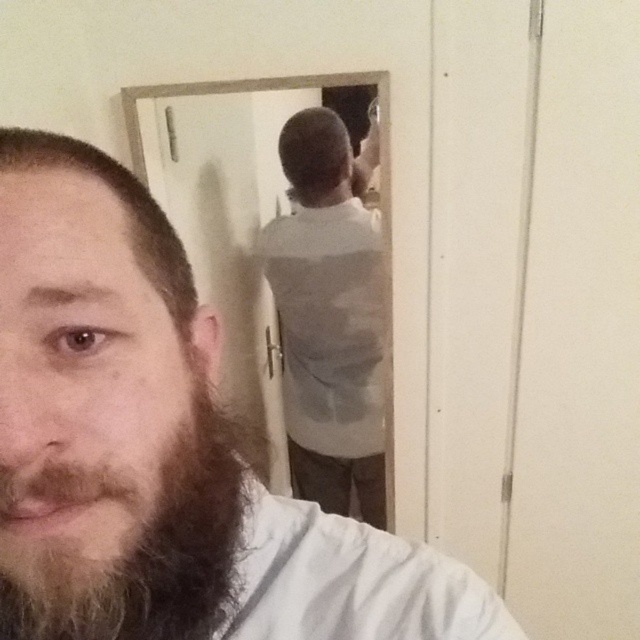
Question: Which point is farther to the camera?

Choices:
 (A) white matte shirt at center
 (B) brown matte hair at left
 (C) light brown hair at left

Answer: (A)

Question: Can you confirm if light brown hair at left is positioned above brown matte hair at left?

Choices:
 (A) yes
 (B) no

Answer: (B)

Question: Which point is farther from the camera taking this photo?

Choices:
 (A) (333, 349)
 (B) (67, 609)
 (C) (104, 404)

Answer: (A)

Question: Is light brown hair at left bigger than dark brown curly beard at left?

Choices:
 (A) yes
 (B) no

Answer: (A)

Question: Which point is closer to the camera?

Choices:
 (A) (172, 316)
 (B) (234, 483)

Answer: (A)

Question: Does white matte shirt at center appear under dark brown curly beard at left?

Choices:
 (A) no
 (B) yes

Answer: (A)